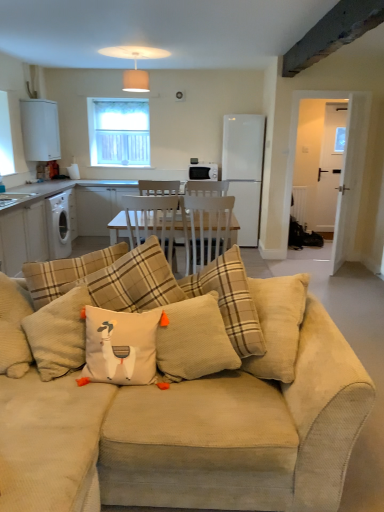
Question: Considering the relative positions of beige corduroy couch at center and white matte refrigerator at center, the 2th appliance from the left, in the image provided, is beige corduroy couch at center to the right of white matte refrigerator at center, the 2th appliance from the left, from the viewer's perspective?

Choices:
 (A) yes
 (B) no

Answer: (B)

Question: Is beige corduroy couch at center outside of white matte refrigerator at center, acting as the first appliance starting from the right?

Choices:
 (A) yes
 (B) no

Answer: (A)

Question: From the image's perspective, is beige corduroy couch at center beneath white matte refrigerator at center, acting as the first appliance starting from the right?

Choices:
 (A) no
 (B) yes

Answer: (B)

Question: Would you consider beige corduroy couch at center to be distant from white matte refrigerator at center, the 2th appliance from the left?

Choices:
 (A) no
 (B) yes

Answer: (B)

Question: Is beige corduroy couch at center facing towards white matte refrigerator at center, the 2th appliance from the left?

Choices:
 (A) yes
 (B) no

Answer: (B)

Question: Considering the relative positions of beige corduroy couch at center and white matte refrigerator at center, the 2th appliance from the left, in the image provided, is beige corduroy couch at center behind white matte refrigerator at center, the 2th appliance from the left,?

Choices:
 (A) yes
 (B) no

Answer: (B)

Question: Is white cotton cushion with orange tassels at center at the left side of beige corduroy couch at center?

Choices:
 (A) no
 (B) yes

Answer: (B)

Question: Considering the relative sizes of white cotton cushion with orange tassels at center and beige corduroy couch at center in the image provided, is white cotton cushion with orange tassels at center smaller than beige corduroy couch at center?

Choices:
 (A) yes
 (B) no

Answer: (A)

Question: Is white cotton cushion with orange tassels at center oriented towards beige corduroy couch at center?

Choices:
 (A) yes
 (B) no

Answer: (A)

Question: Considering the relative sizes of white cotton cushion with orange tassels at center and beige corduroy couch at center in the image provided, is white cotton cushion with orange tassels at center bigger than beige corduroy couch at center?

Choices:
 (A) no
 (B) yes

Answer: (A)

Question: Considering the relative sizes of white cotton cushion with orange tassels at center and beige corduroy couch at center in the image provided, is white cotton cushion with orange tassels at center thinner than beige corduroy couch at center?

Choices:
 (A) yes
 (B) no

Answer: (A)

Question: Is white cotton cushion with orange tassels at center positioned behind beige corduroy couch at center?

Choices:
 (A) no
 (B) yes

Answer: (B)

Question: Can you confirm if clear glass window at upper center is wider than beige corduroy pillow at center, which appears as the 2th pillow when viewed from the right?

Choices:
 (A) yes
 (B) no

Answer: (B)